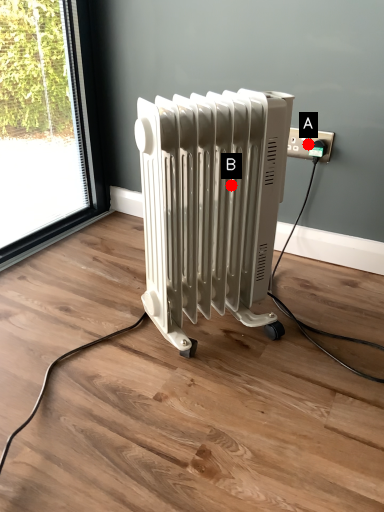
Question: Two points are circled on the image, labeled by A and B beside each circle. Which point is farther to the camera?

Choices:
 (A) A is further
 (B) B is further

Answer: (A)